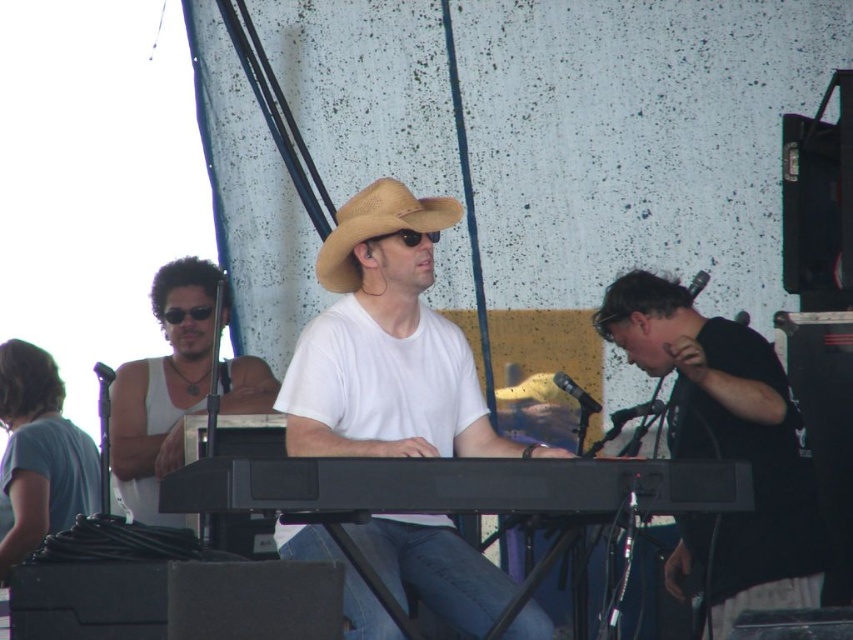
Between black matte shirt at center and white tank top at left, which one is positioned higher?

white tank top at left is above.

Who is positioned more to the right, black matte shirt at center or white tank top at left?

black matte shirt at center

What do you see at coordinates (727, 438) in the screenshot?
I see `black matte shirt at center` at bounding box center [727, 438].

Where is `black matte shirt at center`? This screenshot has height=640, width=853. black matte shirt at center is located at coordinates (727, 438).

Is white matte shirt at center wider than black plastic keyboard at center?

Incorrect, white matte shirt at center's width does not surpass black plastic keyboard at center's.

Is white matte shirt at center closer to camera compared to black plastic keyboard at center?

No, white matte shirt at center is behind black plastic keyboard at center.

This screenshot has height=640, width=853. Find the location of `white matte shirt at center`. white matte shirt at center is located at coordinates (387, 344).

Who is lower down, black matte shirt at center or black plastic keyboard at center?

black matte shirt at center is below.

Is point (711, 330) more distant than point (608, 472)?

Yes, it is.

The width and height of the screenshot is (853, 640). Identify the location of black matte shirt at center. (727, 438).